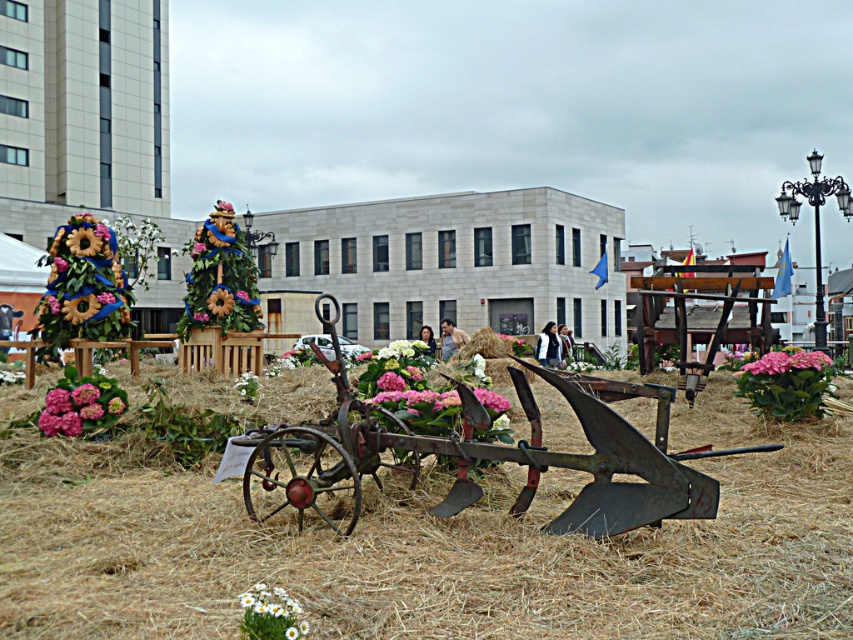
Between point (180, 538) and point (763, 358), which one is positioned in front?

Point (180, 538)

Can you confirm if brown straw at center is bigger than pink matte hydrangea at center right?

Yes, brown straw at center is bigger than pink matte hydrangea at center right.

Describe the element at coordinates (427, 545) in the screenshot. I see `brown straw at center` at that location.

Find the location of a particular element. brown straw at center is located at coordinates (427, 545).

You are a GUI agent. You are given a task and a screenshot of the screen. Output one action in this format:
    pyautogui.click(x=<x>, y=<y>)
    Task: Click on the rusty metal wagon at center
    The height and width of the screenshot is (640, 853).
    Given the screenshot: What is the action you would take?
    pyautogui.click(x=480, y=458)

In order to click on rusty metal wagon at center in this screenshot , I will do `click(480, 458)`.

Where is `rusty metal wagon at center`? rusty metal wagon at center is located at coordinates (480, 458).

Who is more distant from viewer, (114, 460) or (695, 456)?

The point (114, 460) is more distant.

I want to click on brown straw at center, so click(x=427, y=545).